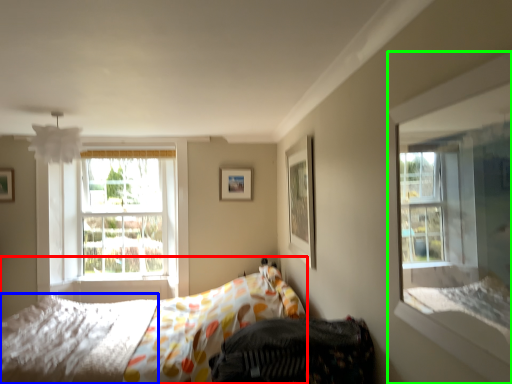
Question: Which object is the farthest from bed (highlighted by a red box)? Choose among these: mattress (highlighted by a blue box) or window (highlighted by a green box).

Choices:
 (A) mattress
 (B) window

Answer: (B)